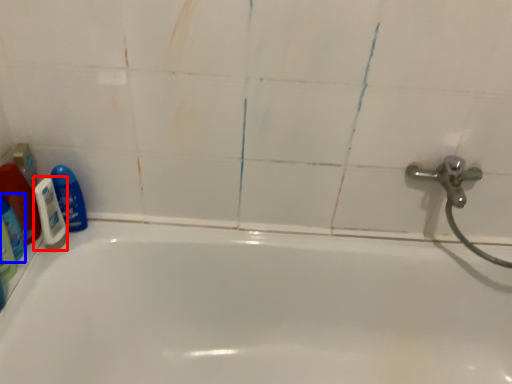
Question: Which object appears closest to the camera in this image, shaving cream (highlighted by a red box) or cleaning product (highlighted by a blue box)?

Choices:
 (A) shaving cream
 (B) cleaning product

Answer: (B)